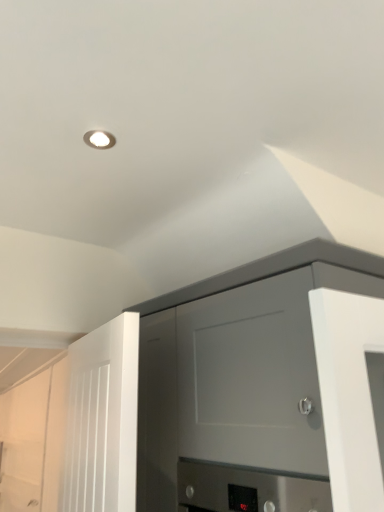
Find the location of `matte gray cabinet at center`. matte gray cabinet at center is located at coordinates (212, 397).

The width and height of the screenshot is (384, 512). What do you see at coordinates (212, 397) in the screenshot?
I see `matte gray cabinet at center` at bounding box center [212, 397].

This screenshot has width=384, height=512. I want to click on matte gray cabinet at center, so click(x=212, y=397).